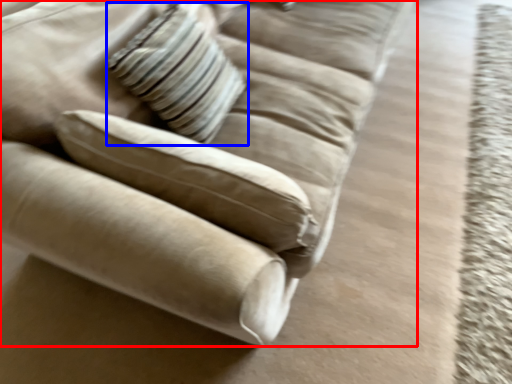
Question: Among these objects, which one is nearest to the camera, studio couch (highlighted by a red box) or pillow (highlighted by a blue box)?

Choices:
 (A) studio couch
 (B) pillow

Answer: (A)